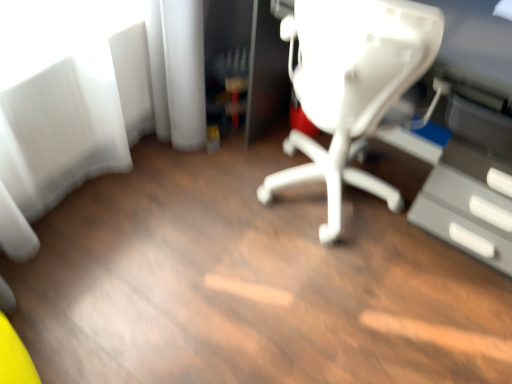
The image size is (512, 384). Find the location of `vacant space positioned to the left of white plastic chair at center`. vacant space positioned to the left of white plastic chair at center is located at coordinates (208, 206).